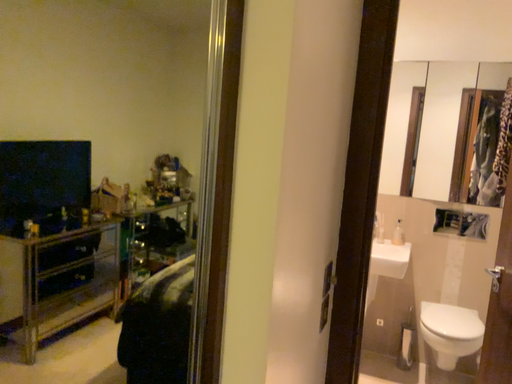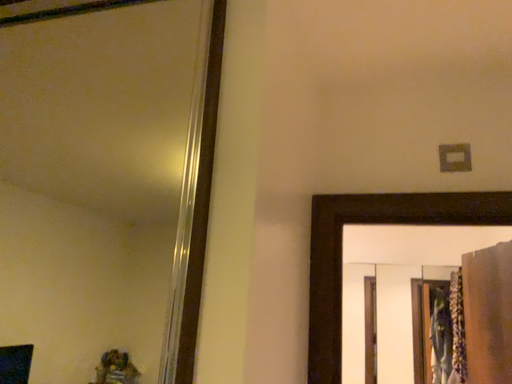
Question: Which way did the camera rotate in the video?

Choices:
 (A) rotated upward
 (B) rotated downward

Answer: (A)